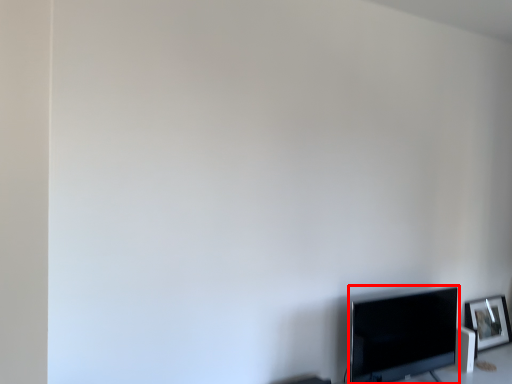
Question: From the image's perspective, what is the correct spatial positioning of television (annotated by the red box) in reference to picture frame?

Choices:
 (A) below
 (B) above

Answer: (B)